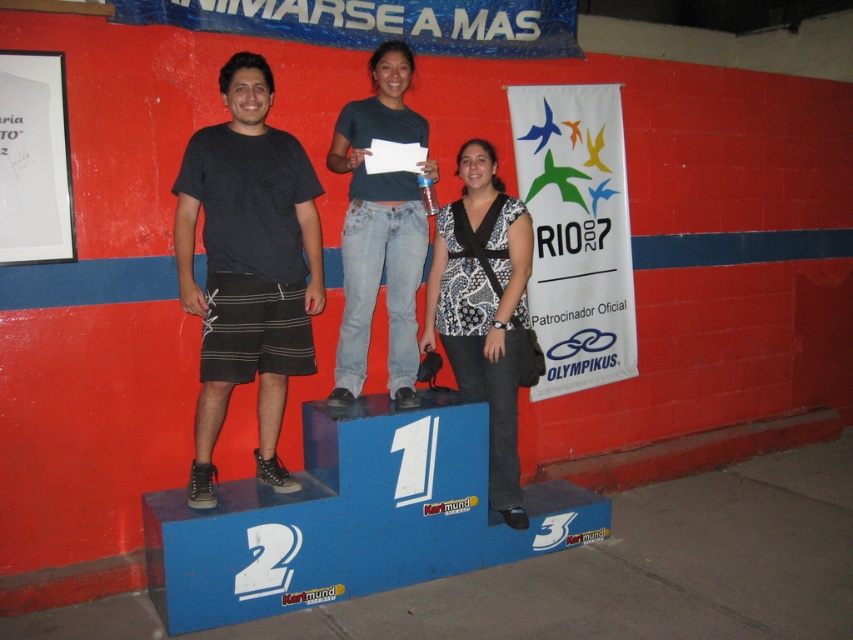
Between black cotton t-shirt at center and patterned fabric blouse at center, which one is positioned lower?

Positioned lower is patterned fabric blouse at center.

Does black cotton t-shirt at center have a greater width compared to patterned fabric blouse at center?

Indeed, black cotton t-shirt at center has a greater width compared to patterned fabric blouse at center.

Is point (242, 310) in front of point (479, 308)?

Yes, it is.

At what (x,y) coordinates should I click in order to perform the action: click on black cotton t-shirt at center. Please return your answer as a coordinate pair (x, y). This screenshot has height=640, width=853. Looking at the image, I should click on (248, 266).

Who is more forward, (257, 65) or (340, 113)?

Point (257, 65) is more forward.

Is point (184, 305) positioned after point (334, 161)?

No, (184, 305) is closer to viewer.

The image size is (853, 640). In order to click on black cotton t-shirt at center in this screenshot , I will do `click(248, 266)`.

Who is positioned more to the right, patterned fabric blouse at center or jeans at center?

From the viewer's perspective, patterned fabric blouse at center appears more on the right side.

What do you see at coordinates (483, 308) in the screenshot? I see `patterned fabric blouse at center` at bounding box center [483, 308].

What do you see at coordinates (483, 308) in the screenshot? This screenshot has height=640, width=853. I see `patterned fabric blouse at center` at bounding box center [483, 308].

This screenshot has height=640, width=853. I want to click on patterned fabric blouse at center, so click(483, 308).